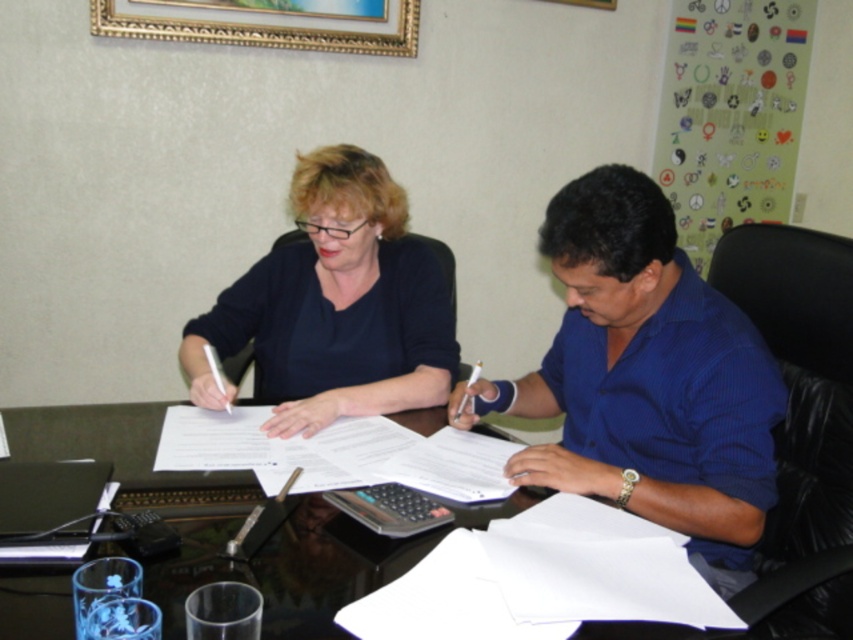
You are organizing a meeting in this office and need to place a name tag on the desk. The name tag is the same size as the white paper at center. Can you fit the name tag next to the matte black shirt at center without overlapping?

The matte black shirt at center is larger in size than the white paper at center. Since the name tag is the same size as the white paper at center, it would be smaller than the matte black shirt. Therefore, there should be enough space to place the name tag next to the matte black shirt at center without overlapping.

You need to place a 12 inch ruler on the desk. Given the black glass table at center and the white paper at center, which surface can accommodate the ruler without it hanging off the edge?

The black glass table at center can accommodate the ruler since its width is larger than the white paper at center.

You are standing 1.5 meters away from the desk in the office scene. There is a point marked at coordinates point (720,634). Can you reach that point without moving closer to the desk?

The distance of point (720,634) from camera is 1.02 meters. Since you are currently 1.5 meters away from the desk, you need to move closer to reach the point as it is only 1.02 meters away from the camera. Therefore, you cannot reach it without moving closer.